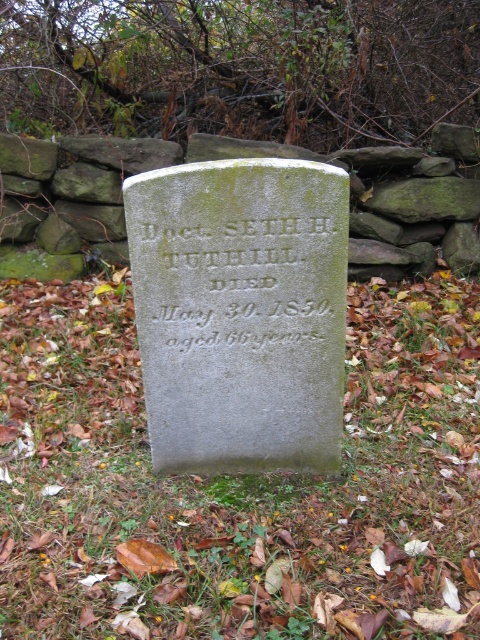
You are standing in an autumn cemetery and see a gravestone with an inscription. There is a point marked at coordinates (233, 480). What object is located at this point?

The green mossy stone at center is located at point (233, 480).

You are standing in an autumn cemetery and see the green mossy stone at center and the green stone inscription at center. Which one is located lower in the image?

The green mossy stone at center is located below the green stone inscription at center, so it is lower in the image.